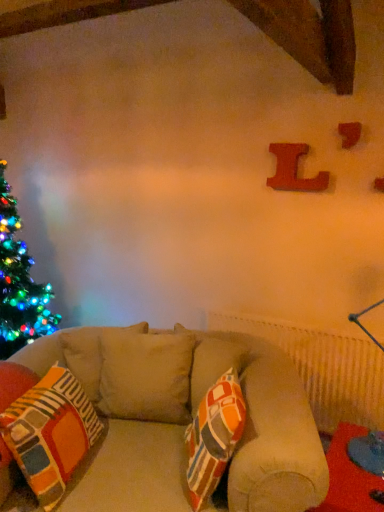
Question: From the image's perspective, is wooden letter at upper right, the 1th alphabet when ordered from front to back, over multicolored fabric pillow at center?

Choices:
 (A) yes
 (B) no

Answer: (A)

Question: Does wooden letter at upper right, the 1th alphabet from the right, have a greater height compared to multicolored fabric pillow at center?

Choices:
 (A) yes
 (B) no

Answer: (B)

Question: From the image's perspective, is wooden letter at upper right, the second alphabet positioned from the back, below multicolored fabric pillow at center?

Choices:
 (A) no
 (B) yes

Answer: (A)

Question: Considering the relative sizes of wooden letter at upper right, the second alphabet positioned from the back, and multicolored fabric pillow at center in the image provided, is wooden letter at upper right, the second alphabet positioned from the back, bigger than multicolored fabric pillow at center?

Choices:
 (A) no
 (B) yes

Answer: (A)

Question: Does wooden letter at upper right, the 1th alphabet when ordered from front to back, appear on the left side of multicolored fabric pillow at center?

Choices:
 (A) yes
 (B) no

Answer: (B)

Question: Is wooden letter at upper right, the 1th alphabet when ordered from front to back, with multicolored fabric pillow at center?

Choices:
 (A) yes
 (B) no

Answer: (B)

Question: Is wooden letter l at upper right, the first alphabet viewed from the left, further to the viewer compared to red fabric table at lower right?

Choices:
 (A) no
 (B) yes

Answer: (B)

Question: Is wooden letter l at upper right, which appears as the second alphabet when viewed from the right, positioned with its back to red fabric table at lower right?

Choices:
 (A) no
 (B) yes

Answer: (A)

Question: Is wooden letter l at upper right, which appears as the second alphabet when viewed from the right, at the right side of red fabric table at lower right?

Choices:
 (A) yes
 (B) no

Answer: (B)

Question: From the image's perspective, is wooden letter l at upper right, the first alphabet viewed from the left, below red fabric table at lower right?

Choices:
 (A) no
 (B) yes

Answer: (A)

Question: Can you confirm if wooden letter l at upper right, which appears as the second alphabet when viewed from the right, is taller than red fabric table at lower right?

Choices:
 (A) yes
 (B) no

Answer: (B)

Question: From a real-world perspective, is wooden letter l at upper right, which appears as the second alphabet when viewed from the right, located higher than red fabric table at lower right?

Choices:
 (A) yes
 (B) no

Answer: (A)

Question: From the image's perspective, is red fabric table at lower right on wooden letter l at upper right, which appears as the second alphabet when viewed from the right?

Choices:
 (A) no
 (B) yes

Answer: (A)